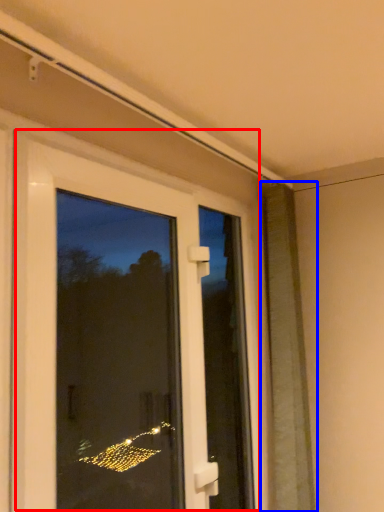
Question: Which of the following is the closest to the observer, door (highlighted by a red box) or shutter (highlighted by a blue box)?

Choices:
 (A) door
 (B) shutter

Answer: (A)